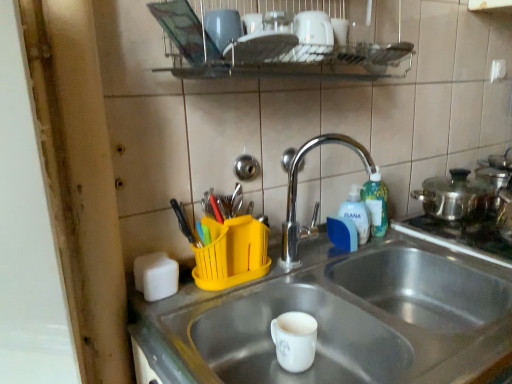
Question: Is yellow plastic utensil holder at upper center positioned in front of white glossy mug at center?

Choices:
 (A) yes
 (B) no

Answer: (A)

Question: Does yellow plastic utensil holder at upper center have a lesser height compared to white glossy mug at center?

Choices:
 (A) yes
 (B) no

Answer: (B)

Question: From a real-world perspective, is yellow plastic utensil holder at upper center on white glossy mug at center?

Choices:
 (A) no
 (B) yes

Answer: (B)

Question: Considering the relative sizes of yellow plastic utensil holder at upper center and white glossy mug at center in the image provided, is yellow plastic utensil holder at upper center bigger than white glossy mug at center?

Choices:
 (A) yes
 (B) no

Answer: (A)

Question: From a real-world perspective, is yellow plastic utensil holder at upper center under white glossy mug at center?

Choices:
 (A) no
 (B) yes

Answer: (A)

Question: Is yellow plastic utensil holder at upper center not within white glossy mug at center?

Choices:
 (A) no
 (B) yes

Answer: (B)

Question: Does chrome/metallic faucet at center have a greater height compared to green translucent bottle at right, which is the second bottle in left-to-right order?

Choices:
 (A) no
 (B) yes

Answer: (B)

Question: Is green translucent bottle at right, which is the second bottle in left-to-right order, surrounded by chrome/metallic faucet at center?

Choices:
 (A) no
 (B) yes

Answer: (A)

Question: From a real-world perspective, is chrome/metallic faucet at center under green translucent bottle at right, the 1th bottle from the right?

Choices:
 (A) yes
 (B) no

Answer: (B)

Question: Can you confirm if chrome/metallic faucet at center is smaller than green translucent bottle at right, the 1th bottle from the right?

Choices:
 (A) no
 (B) yes

Answer: (A)

Question: Is chrome/metallic faucet at center closer to the viewer compared to green translucent bottle at right, which is the second bottle in left-to-right order?

Choices:
 (A) no
 (B) yes

Answer: (B)

Question: Is chrome/metallic faucet at center to the right of green translucent bottle at right, which is the second bottle in left-to-right order, from the viewer's perspective?

Choices:
 (A) yes
 (B) no

Answer: (B)

Question: Does yellow plastic utensil holder at upper center have a lesser width compared to chrome/metallic faucet at center?

Choices:
 (A) yes
 (B) no

Answer: (A)